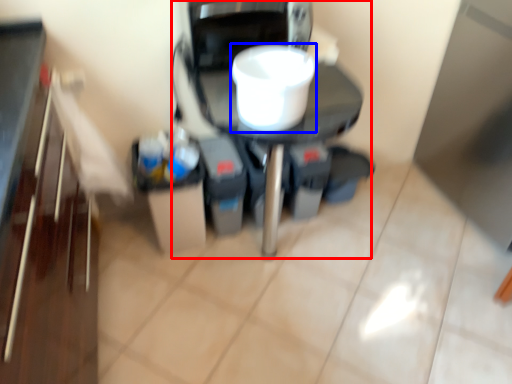
Question: Which of the following is the closest to the observer, appliance (highlighted by a red box) or appliance (highlighted by a blue box)?

Choices:
 (A) appliance
 (B) appliance

Answer: (B)